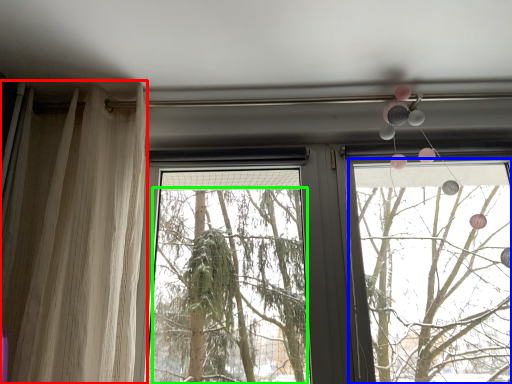
Question: Considering the real-world distances, which object is farthest from curtain (highlighted by a red box)? window frame (highlighted by a blue box) or tree (highlighted by a green box)?

Choices:
 (A) window frame
 (B) tree

Answer: (A)